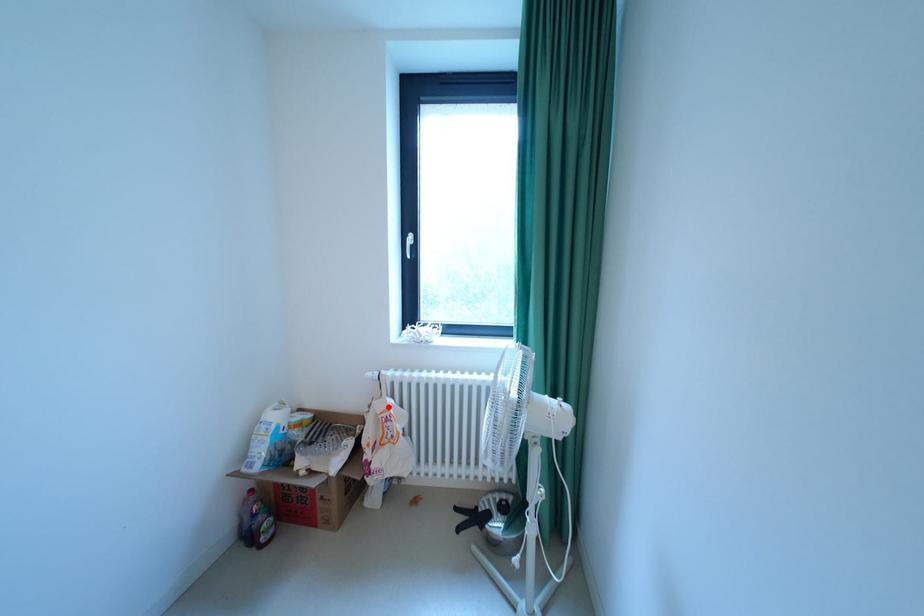
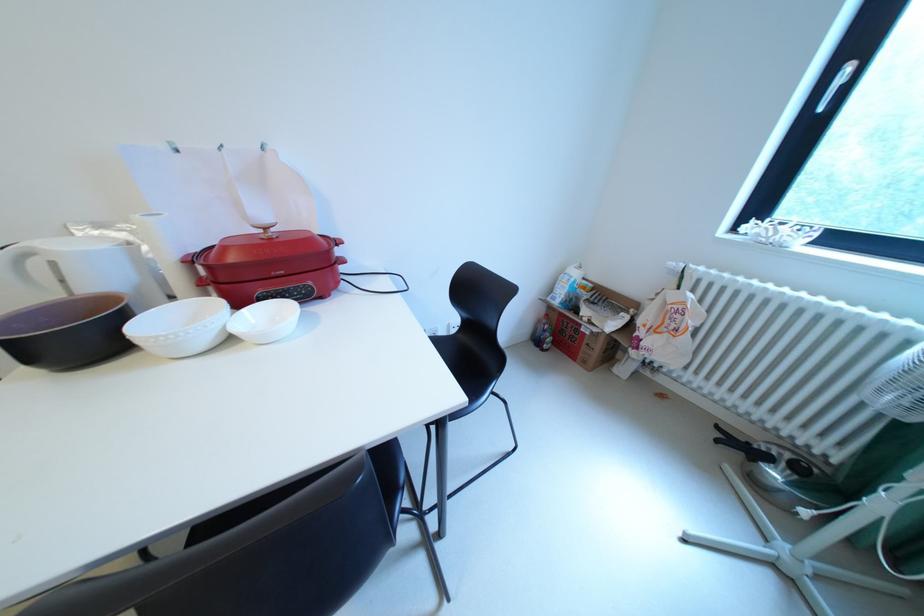
The point at the highlighted location is marked in the first image. Where is the corresponding point in the second image?

(682, 297)